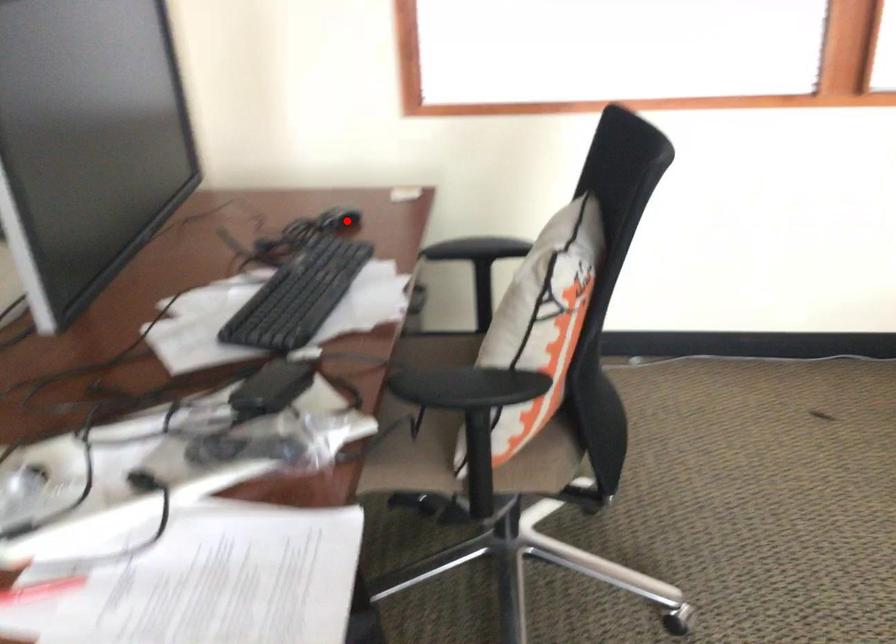
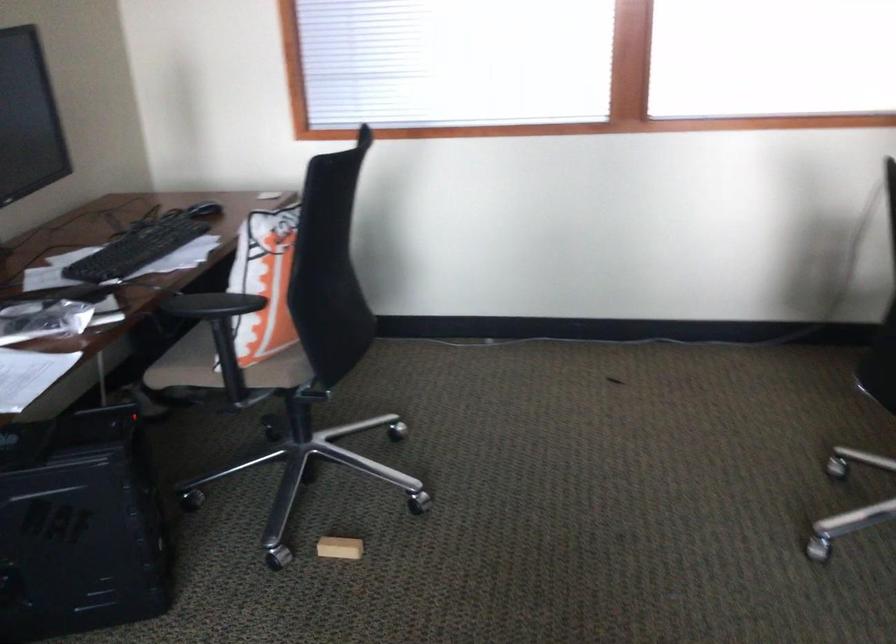
In the second image, find the point that corresponds to the highlighted location in the first image.

(204, 210)